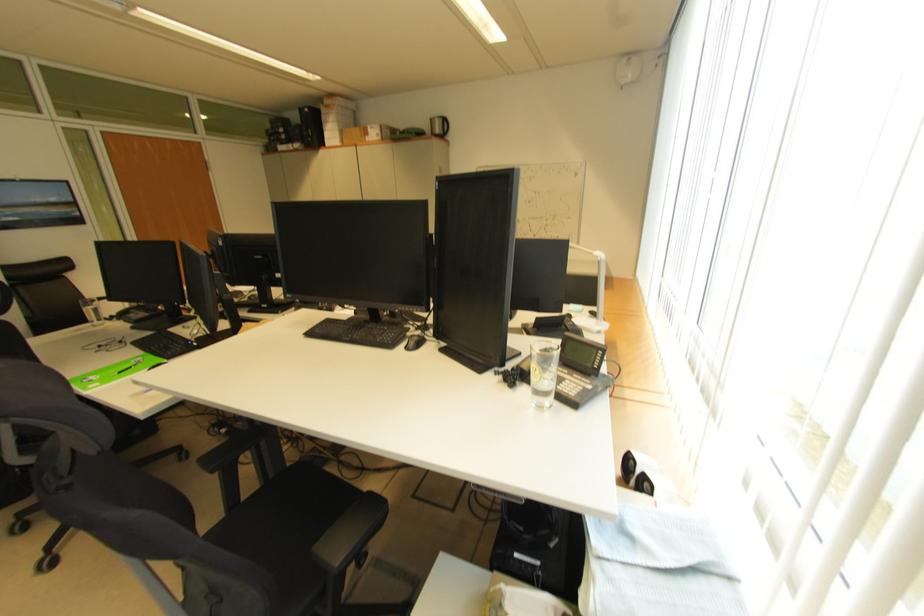
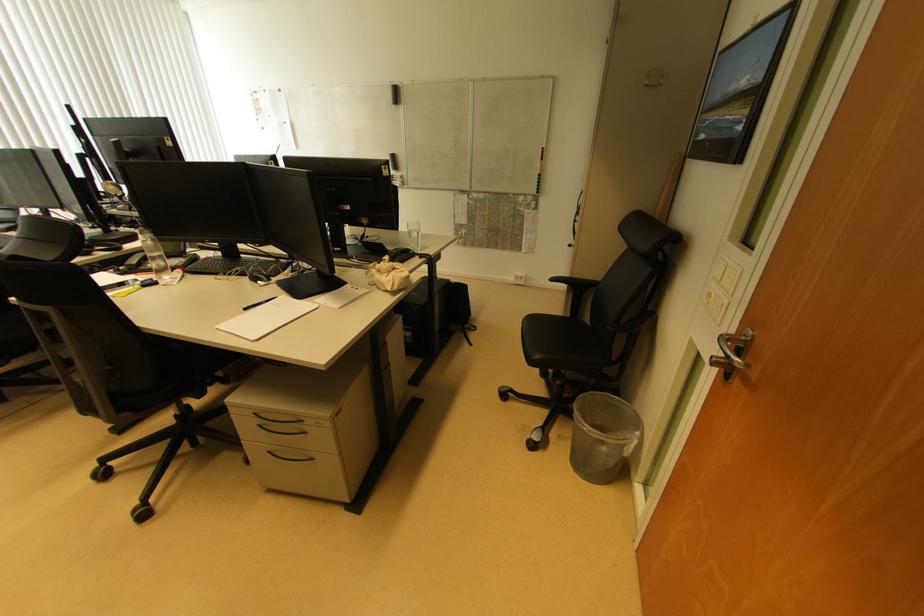
Question: I am providing you with two images of the same scene from different viewpoints. After the viewpoint changes to image2, which objects are now occluded?

Choices:
 (A) clear water glass
 (B) clear trash can
 (C) patterned pink pillow
 (D) black chair sitting surface

Answer: (A)